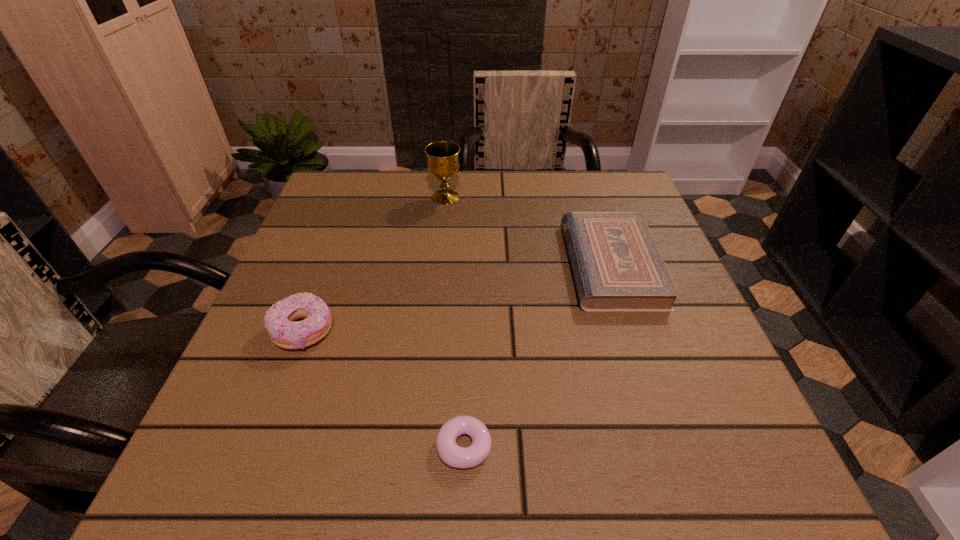
The height and width of the screenshot is (540, 960). Find the location of `empty space that is in between the rightmost object and the chalice`. empty space that is in between the rightmost object and the chalice is located at coordinates coord(528,231).

Locate an element on the screen. vacant area between the chalice and the shorter doughnut is located at coordinates (455, 322).

You are a GUI agent. You are given a task and a screenshot of the screen. Output one action in this format:
    pyautogui.click(x=<x>, y=<y>)
    Task: Click on the free point between the shorter doughnut and the second shortest object
    This screenshot has height=540, width=960.
    Given the screenshot: What is the action you would take?
    pyautogui.click(x=538, y=355)

Where is `vacant space in between the Bible and the taller doughnut`? This screenshot has height=540, width=960. vacant space in between the Bible and the taller doughnut is located at coordinates (457, 298).

Where is `blank region between the chalice and the second tallest object`? This screenshot has height=540, width=960. blank region between the chalice and the second tallest object is located at coordinates (374, 264).

Identify which object is the second nearest to the shorter doughnut. Please provide its 2D coordinates. Your answer should be formatted as a tuple, i.e. [(x, y)], where the tuple contains the x and y coordinates of a point satisfying the conditions above.

[(617, 266)]

This screenshot has width=960, height=540. In order to click on the third closest object relative to the second shortest object in this screenshot , I will do `click(278, 320)`.

In order to click on free space that satisfies the following two spatial constraints: 1. on the spine side of the rightmost object; 2. on the front side of the leftmost object in this screenshot , I will do `click(633, 331)`.